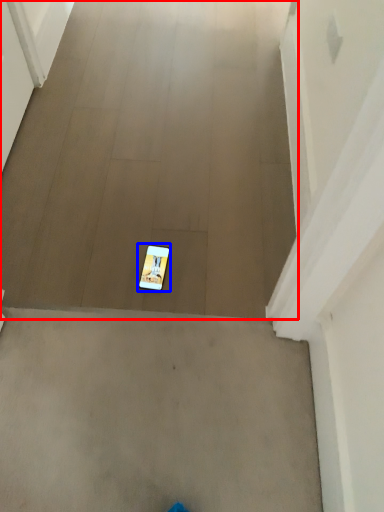
Question: Which object is further to the camera taking this photo, concrete (highlighted by a red box) or mobile phone (highlighted by a blue box)?

Choices:
 (A) concrete
 (B) mobile phone

Answer: (B)